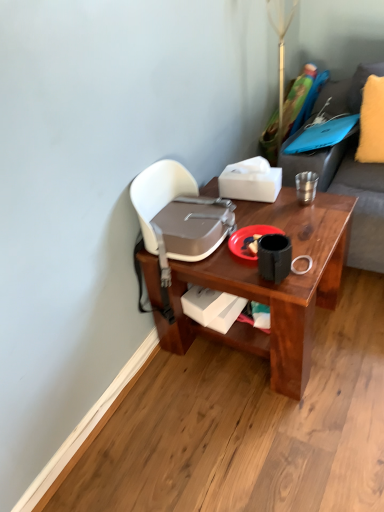
Question: From a real-world perspective, is yellow fuzzy pillow at upper right physically below red matte plate at center?

Choices:
 (A) yes
 (B) no

Answer: (B)

Question: Is yellow fuzzy pillow at upper right shorter than red matte plate at center?

Choices:
 (A) yes
 (B) no

Answer: (B)

Question: Can you confirm if yellow fuzzy pillow at upper right is bigger than red matte plate at center?

Choices:
 (A) no
 (B) yes

Answer: (B)

Question: From the image's perspective, is yellow fuzzy pillow at upper right located beneath red matte plate at center?

Choices:
 (A) no
 (B) yes

Answer: (A)

Question: Considering the relative positions of yellow fuzzy pillow at upper right and red matte plate at center in the image provided, is yellow fuzzy pillow at upper right behind red matte plate at center?

Choices:
 (A) no
 (B) yes

Answer: (B)

Question: Is yellow fuzzy pillow at upper right thinner than red matte plate at center?

Choices:
 (A) yes
 (B) no

Answer: (A)

Question: Is metallic pole at upper center wider than white matte tissue box at upper center, which ranks as the 2th box in bottom-to-top order?

Choices:
 (A) no
 (B) yes

Answer: (A)

Question: Is metallic pole at upper center further to camera compared to white matte tissue box at upper center, which ranks as the 2th box in bottom-to-top order?

Choices:
 (A) yes
 (B) no

Answer: (A)

Question: Would you say metallic pole at upper center is outside white matte tissue box at upper center, which ranks as the 2th box in bottom-to-top order?

Choices:
 (A) no
 (B) yes

Answer: (B)

Question: From a real-world perspective, is metallic pole at upper center physically below white matte tissue box at upper center, which ranks as the 2th box in bottom-to-top order?

Choices:
 (A) yes
 (B) no

Answer: (B)

Question: From the image's perspective, is metallic pole at upper center beneath white matte tissue box at upper center, positioned as the 1th box in top-to-bottom order?

Choices:
 (A) yes
 (B) no

Answer: (B)

Question: Is metallic pole at upper center positioned far away from white matte tissue box at upper center, which ranks as the 2th box in bottom-to-top order?

Choices:
 (A) yes
 (B) no

Answer: (B)

Question: Is white matte tissue box at upper center, which ranks as the 2th box in bottom-to-top order, not within yellow fuzzy pillow at upper right?

Choices:
 (A) no
 (B) yes

Answer: (B)